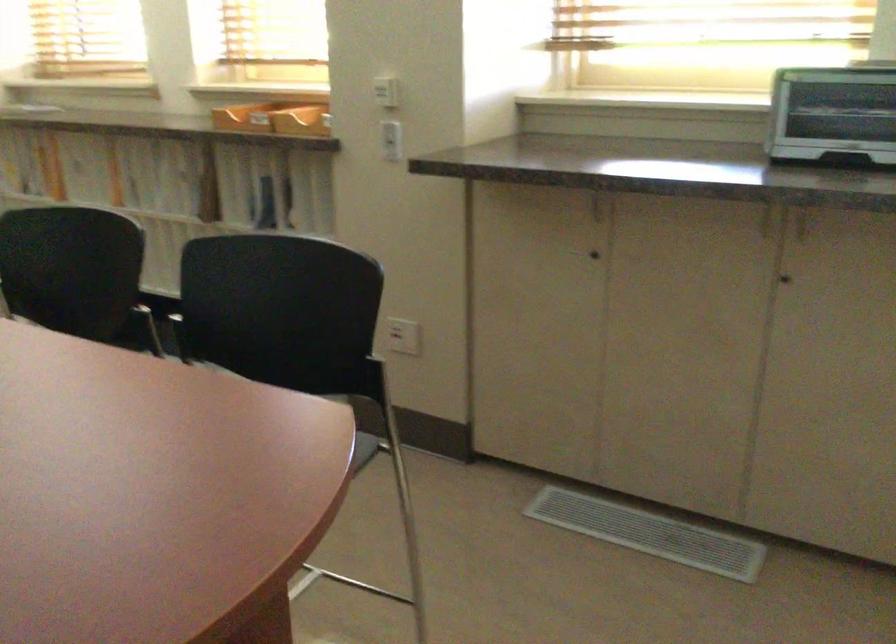
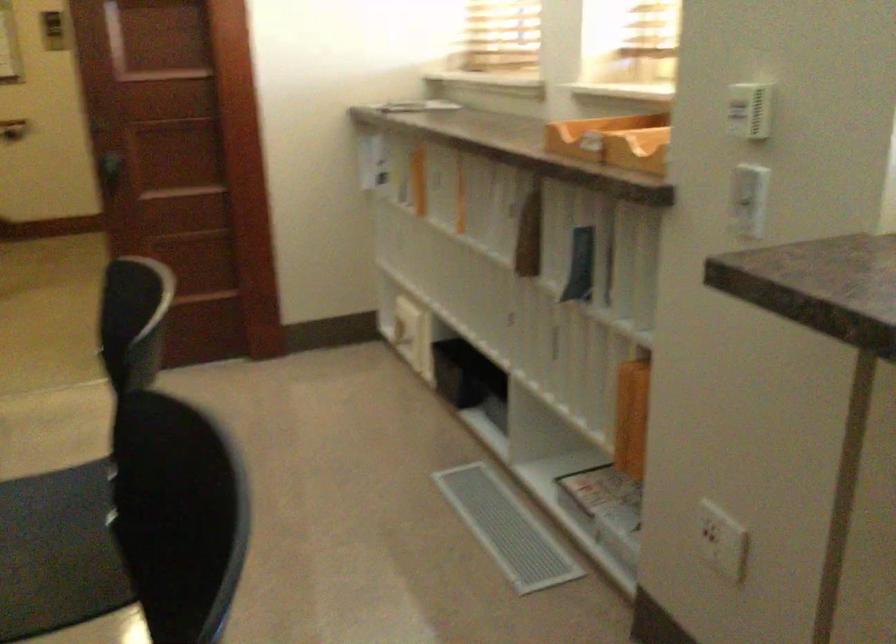
Locate, in the second image, the point that corresponds to pixel 391 129 in the first image.

(748, 190)